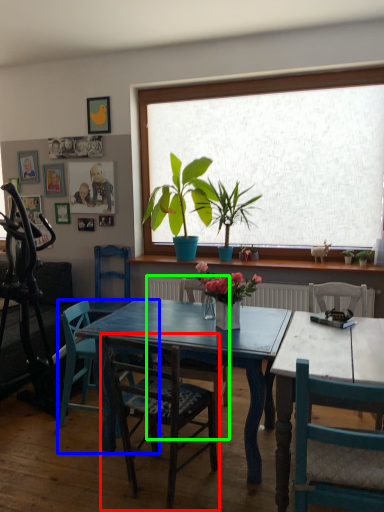
Question: Considering the real-world distances, which object is closest to chair (highlighted by a red box)? chair (highlighted by a blue box) or chair (highlighted by a green box).

Choices:
 (A) chair
 (B) chair

Answer: (B)